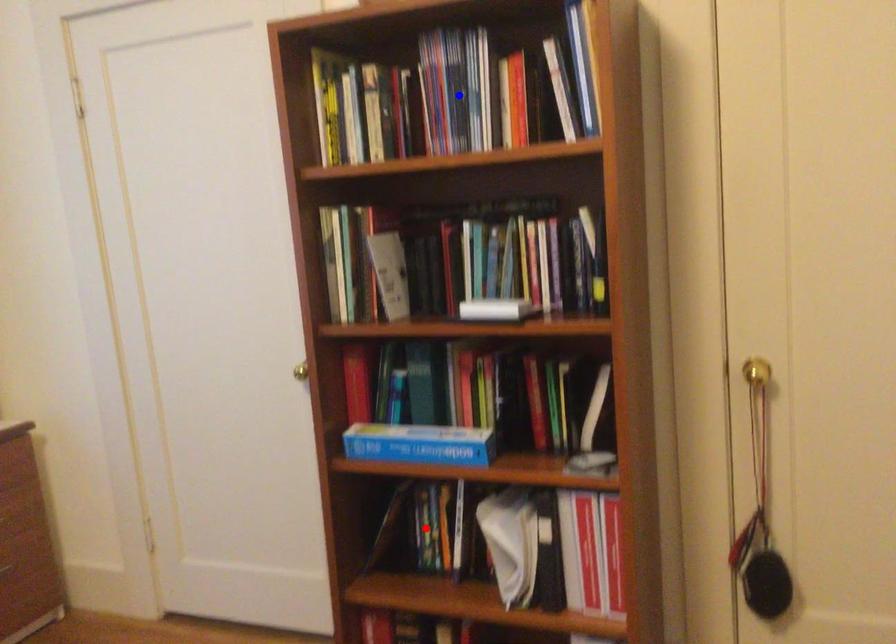
Question: Which of the two points in the image is closer to the camera?

Choices:
 (A) Blue point is closer.
 (B) Red point is closer.

Answer: (A)